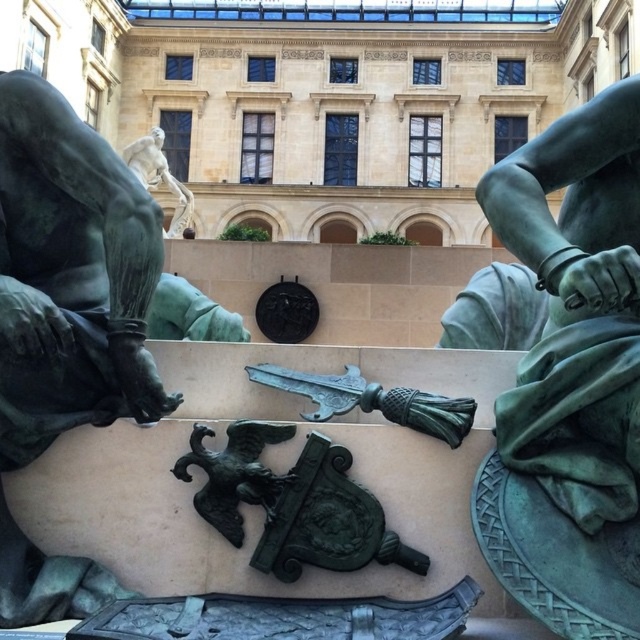
Which is in front, point (48, 312) or point (150, 180)?

Point (48, 312)

Does bronze statue at left have a smaller size compared to bronze statue at upper center?

Yes, bronze statue at left is smaller than bronze statue at upper center.

Who is more distant from viewer, (4, 358) or (184, 192)?

The point (184, 192) is behind.

You are a GUI agent. You are given a task and a screenshot of the screen. Output one action in this format:
    pyautogui.click(x=<x>, y=<y>)
    Task: Click on the bronze statue at left
    Image resolution: width=640 pixels, height=640 pixels.
    Given the screenshot: What is the action you would take?
    pyautogui.click(x=68, y=276)